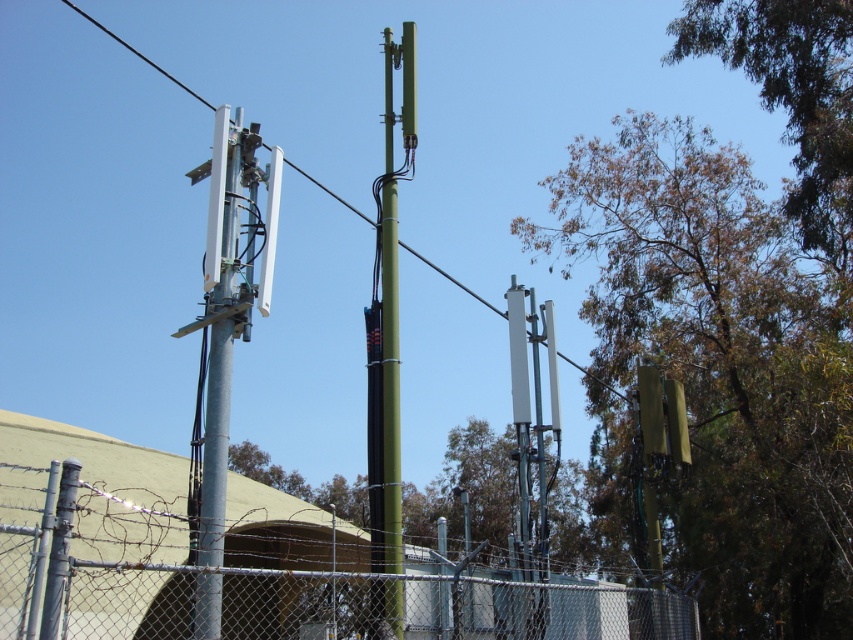
Question: Which point is farther from the camera taking this photo?

Choices:
 (A) (836, 266)
 (B) (659, 435)
 (C) (227, 410)

Answer: (A)

Question: Which point is farther to the camera?

Choices:
 (A) metallic gray pole at left
 (B) metallic green traffic light at right

Answer: (B)

Question: Which of the following is the farthest from the observer?

Choices:
 (A) green matte pole at center
 (B) metal chain-link fence at lower center

Answer: (A)

Question: Does green matte/rough telegraph pole at center appear on the right side of green matte pole at center?

Choices:
 (A) no
 (B) yes

Answer: (B)

Question: Does metal chain-link fence at lower center appear on the right side of metallic gray pole at left?

Choices:
 (A) no
 (B) yes

Answer: (A)

Question: In this image, where is green leafy tree at upper right located relative to metallic gray pole at left?

Choices:
 (A) below
 (B) above

Answer: (A)